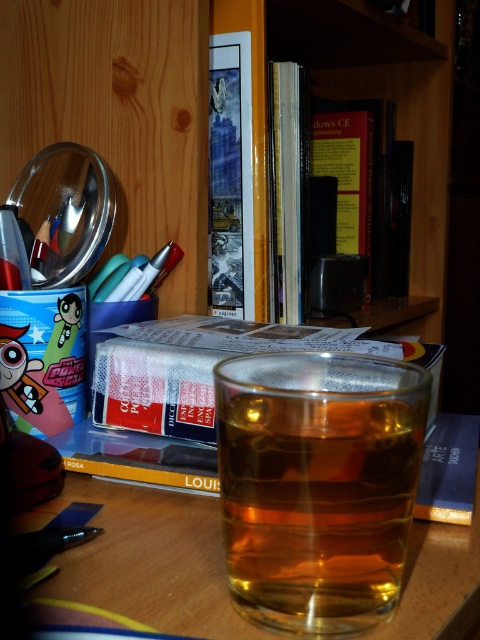
Question: Which point is closer to the camera?

Choices:
 (A) translucent glass at center
 (B) hardcover books at center
 (C) transparent glass at center

Answer: (A)

Question: Does translucent glass at center appear over hardcover books at center?

Choices:
 (A) no
 (B) yes

Answer: (A)

Question: Which object appears farthest from the camera in this image?

Choices:
 (A) translucent glass at center
 (B) transparent glass at center
 (C) hardcover books at center

Answer: (C)

Question: Does translucent glass at center appear on the right side of transparent glass at center?

Choices:
 (A) yes
 (B) no

Answer: (A)

Question: Does translucent glass at center have a larger size compared to transparent glass at center?

Choices:
 (A) no
 (B) yes

Answer: (A)

Question: Which object is farther from the camera taking this photo?

Choices:
 (A) transparent glass at center
 (B) translucent glass at center
 (C) hardcover books at center

Answer: (C)